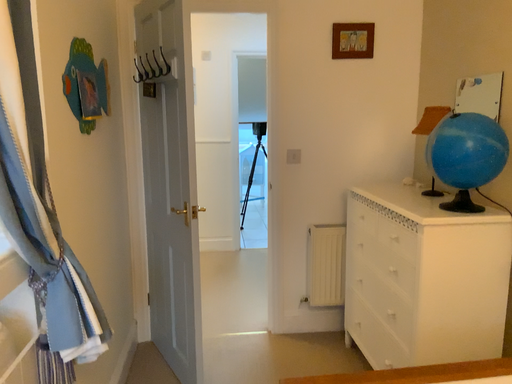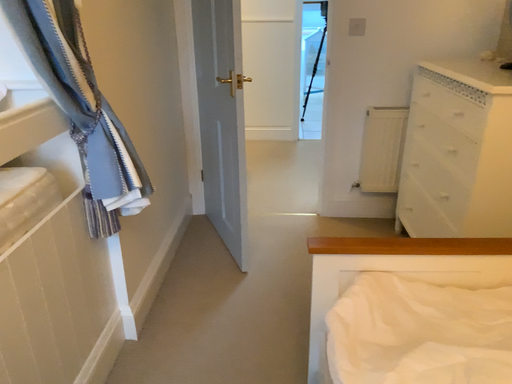
Question: How did the camera likely rotate when shooting the video?

Choices:
 (A) rotated upward
 (B) rotated downward

Answer: (B)